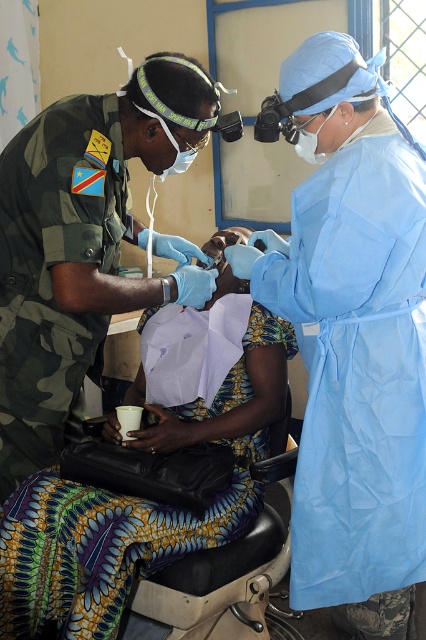
In the scene shown: In the medical scene, there is a point labeled as point (353,337). Which object from the list below is located at this point? Choose from the options below. 1. Military camouflage uniform with blue and yellow patch 2. Blue smooth gown at center

The point (353,337) corresponds to the blue smooth gown at center.

What is the location of the point marked at coordinates (138, 502) in the image?

The point marked at coordinates (138, 502) is located on the printed fabric skirt at center.